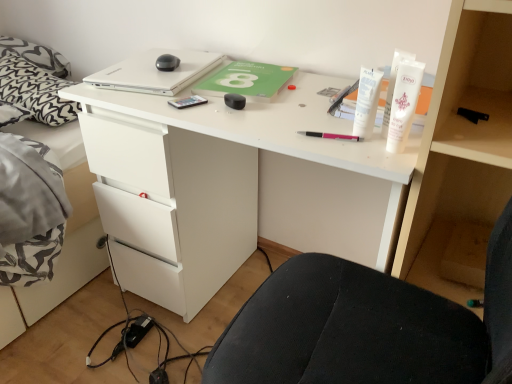
Locate an element on the screen. This screenshot has height=384, width=512. vacant space to the left of pink plastic pen at center, acting as the 3th stationery starting from the back is located at coordinates (262, 127).